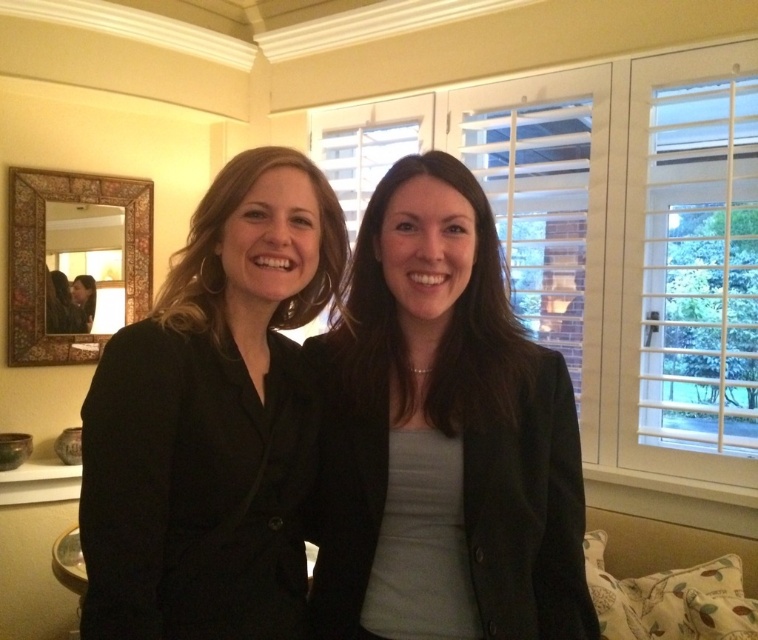
Question: Is black matte blazer at left bigger than matte black blazer at center?

Choices:
 (A) no
 (B) yes

Answer: (B)

Question: Where is black matte blazer at left located in relation to matte black blazer at center in the image?

Choices:
 (A) below
 (B) above

Answer: (B)

Question: Which object is farther from the camera taking this photo?

Choices:
 (A) black matte blazer at left
 (B) matte black blazer at center

Answer: (B)

Question: Among these objects, which one is nearest to the camera?

Choices:
 (A) matte black blazer at center
 (B) black matte blazer at left

Answer: (B)

Question: Can you confirm if black matte blazer at left is positioned to the left of matte black blazer at center?

Choices:
 (A) no
 (B) yes

Answer: (B)